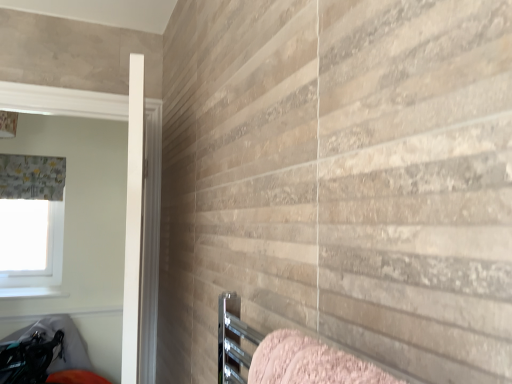
The image size is (512, 384). What do you see at coordinates (286, 356) in the screenshot?
I see `pink textured towel at lower right` at bounding box center [286, 356].

In order to face textured gray curtain at left, should I rotate leftwards or rightwards?

To face it directly, rotate left by 27.745 degrees.

This screenshot has height=384, width=512. What do you see at coordinates (25, 236) in the screenshot? I see `white fabric at upper left` at bounding box center [25, 236].

Where is `pink textured towel at lower right`? The image size is (512, 384). pink textured towel at lower right is located at coordinates (286, 356).

Between point (151, 377) and point (262, 366), which one is positioned in front?

The point (262, 366) is in front.

Is there a large distance between white smooth door at left and pink textured towel at lower right?

white smooth door at left is far away from pink textured towel at lower right.

In the image, is white fabric at upper left on the left side or the right side of white smooth door at left?

Based on their positions, white fabric at upper left is located to the left of white smooth door at left.

There is a white fabric at upper left. Where is `screen door above it (from a real-world perspective)`? The image size is (512, 384). screen door above it (from a real-world perspective) is located at coordinates (141, 231).

Considering the points (20, 272) and (135, 296), which point is behind, point (20, 272) or point (135, 296)?

The point (20, 272) is farther from the camera.

From a real-world perspective, is white fabric at upper left beneath white smooth door at left?

Correct, in the physical world, white fabric at upper left is lower than white smooth door at left.

Is point (31, 292) closer or farther from the camera than point (258, 381)?

Point (31, 292) is farther from the camera than point (258, 381).

In terms of width, does white glossy window sill at lower left look wider or thinner when compared to pink textured towel at lower right?

Considering their sizes, white glossy window sill at lower left looks broader than pink textured towel at lower right.

Is white glossy window sill at lower left spatially inside pink textured towel at lower right, or outside of it?

white glossy window sill at lower left lies outside pink textured towel at lower right.

This screenshot has height=384, width=512. Identify the location of bed that appears below the white smooth door at left (from the image's perspective). (x=286, y=356).

Consider the image. Does pink textured towel at lower right touch white smooth door at left?

They are not placed beside each other.

Does pink textured towel at lower right come in front of white smooth door at left?

Yes, pink textured towel at lower right is in front of white smooth door at left.

Does pink textured towel at lower right appear on the right side of white smooth door at left?

Yes, pink textured towel at lower right is to the right of white smooth door at left.

Which object is positioned more to the right, pink textured towel at lower right or textured gray curtain at left?

Positioned to the right is pink textured towel at lower right.

Based on the photo, is pink textured towel at lower right situated inside textured gray curtain at left or outside?

pink textured towel at lower right is located beyond the bounds of textured gray curtain at left.

Is pink textured towel at lower right positioned behind textured gray curtain at left?

No, pink textured towel at lower right is closer to the viewer.

Can white smooth door at left be found inside textured gray curtain at left?

No, white smooth door at left is located outside of textured gray curtain at left.

Locate an element on the screen. Image resolution: width=512 pixels, height=384 pixels. screen door lying below the textured gray curtain at left (from the image's perspective) is located at coordinates (141, 231).

From the picture: From the image's perspective, who appears lower, white smooth door at left or white fabric at upper left?

white fabric at upper left is shown below in the image.

Which of these two, white smooth door at left or white fabric at upper left, is bigger?

With larger size is white smooth door at left.

Between white smooth door at left and white fabric at upper left, which one is positioned behind?

white fabric at upper left is further away from the camera.

Find the location of a particular element. The height and width of the screenshot is (384, 512). screen door in front of the white fabric at upper left is located at coordinates (141, 231).

Image resolution: width=512 pixels, height=384 pixels. I want to click on bed on the right of the white smooth door at left, so click(x=286, y=356).

Where is `window screen behind the white smooth door at left`? This screenshot has width=512, height=384. window screen behind the white smooth door at left is located at coordinates (25, 236).

Estimate the real-world distances between objects in this image. Which object is further from white glossy window sill at lower left, white smooth door at left or white fabric at upper left?

Among the two, white smooth door at left is located further to white glossy window sill at lower left.

Looking at this image, from the image, which object appears to be nearer to pink textured towel at lower right, white fabric at upper left or white smooth door at left?

white smooth door at left.

When comparing their distances from white fabric at upper left, does white smooth door at left or textured gray curtain at left seem closer?

textured gray curtain at left lies closer to white fabric at upper left than the other object.

Looking at this image, considering their positions, is pink textured towel at lower right positioned closer to white glossy window sill at lower left than white fabric at upper left?

white fabric at upper left lies closer to white glossy window sill at lower left than the other object.

When comparing their distances from white smooth door at left, does textured gray curtain at left or white glossy window sill at lower left seem closer?

Among the two, textured gray curtain at left is located nearer to white smooth door at left.

From the image, which object appears to be nearer to white glossy window sill at lower left, white fabric at upper left or pink textured towel at lower right?

white fabric at upper left.

From the picture: Which object lies nearer to the anchor point pink textured towel at lower right, white glossy window sill at lower left or textured gray curtain at left?

white glossy window sill at lower left lies closer to pink textured towel at lower right than the other object.

Estimate the real-world distances between objects in this image. Which object is further from white glossy window sill at lower left, white fabric at upper left or textured gray curtain at left?

textured gray curtain at left.

Image resolution: width=512 pixels, height=384 pixels. Identify the location of screen door positioned between pink textured towel at lower right and white fabric at upper left from near to far. (141, 231).

Image resolution: width=512 pixels, height=384 pixels. What are the coordinates of `screen door between pink textured towel at lower right and textured gray curtain at left from front to back` in the screenshot? It's located at (141, 231).

At what (x,y) coordinates should I click in order to perform the action: click on curtain between pink textured towel at lower right and white fabric at upper left in the front-back direction. Please return your answer as a coordinate pair (x, y). Looking at the image, I should click on (32, 177).

This screenshot has height=384, width=512. Identify the location of window sill between pink textured towel at lower right and textured gray curtain at left from front to back. (32, 292).